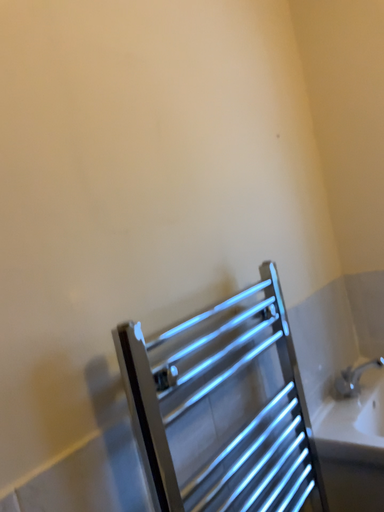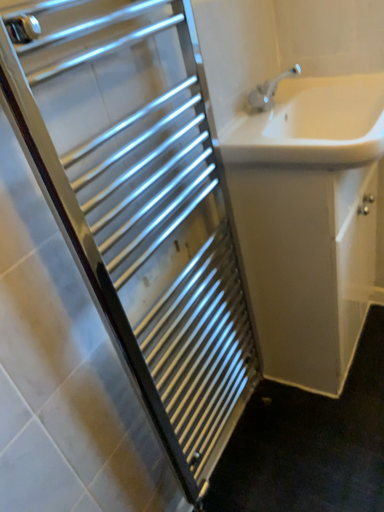
Question: How did the camera likely rotate when shooting the video?

Choices:
 (A) rotated downward
 (B) rotated upward

Answer: (A)